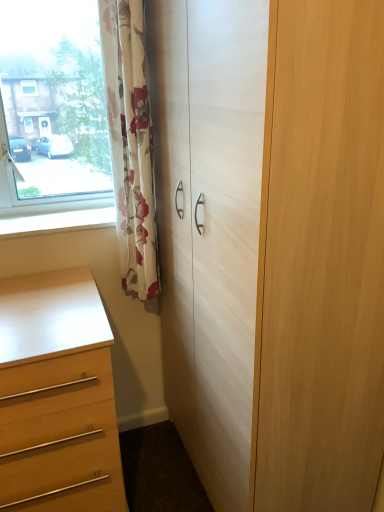
The width and height of the screenshot is (384, 512). I want to click on white wood cupboard at center, so click(272, 245).

At what (x,y) coordinates should I click in order to perform the action: click on white wood cupboard at center. Please return your answer as a coordinate pair (x, y). Looking at the image, I should click on (272, 245).

Do you think white glossy window sill at lower left is within floral fabric curtain at left, or outside of it?

white glossy window sill at lower left is spatially situated outside floral fabric curtain at left.

How many degrees apart are the facing directions of white glossy window sill at lower left and floral fabric curtain at left?

There is a 1.5-degree angle between the facing directions of white glossy window sill at lower left and floral fabric curtain at left.

From the image's perspective, is white glossy window sill at lower left beneath floral fabric curtain at left?

Yes.

Is matte wood chest of drawers at lower left closer to camera compared to white wood cupboard at center?

No, it is not.

How much distance is there between matte wood chest of drawers at lower left and white wood cupboard at center?

A distance of 20.18 inches exists between matte wood chest of drawers at lower left and white wood cupboard at center.

Is matte wood chest of drawers at lower left turned away from white wood cupboard at center?

matte wood chest of drawers at lower left does not have its back to white wood cupboard at center.

Consider the image. Which is closer, (39,222) or (93,483)?

Positioned in front is point (93,483).

How different are the orientations of white glossy window sill at lower left and matte wood chest of drawers at lower left in degrees?

They differ by 0.0898 degrees in their facing directions.

Does white glossy window sill at lower left appear on the right side of matte wood chest of drawers at lower left?

Indeed, white glossy window sill at lower left is positioned on the right side of matte wood chest of drawers at lower left.

Which object is wider, white glossy window sill at lower left or matte wood chest of drawers at lower left?

matte wood chest of drawers at lower left.

Is white wood cupboard at center next to matte wood chest of drawers at lower left and touching it?

No, white wood cupboard at center is not next to matte wood chest of drawers at lower left.

From a real-world perspective, who is located higher, white wood cupboard at center or matte wood chest of drawers at lower left?

From a 3D spatial view, white wood cupboard at center is above.

In the scene shown: Can you confirm if white wood cupboard at center is thinner than matte wood chest of drawers at lower left?

Yes.

You are a GUI agent. You are given a task and a screenshot of the screen. Output one action in this format:
    pyautogui.click(x=<x>, y=<y>)
    Task: Click on the chest of drawers lying on the left of white wood cupboard at center
    The width and height of the screenshot is (384, 512).
    Given the screenshot: What is the action you would take?
    pyautogui.click(x=57, y=396)

Is white glossy window sill at lower left aimed at white wood cupboard at center?

No, white glossy window sill at lower left is not facing towards white wood cupboard at center.

Who is bigger, white glossy window sill at lower left or white wood cupboard at center?

white wood cupboard at center.

Image resolution: width=384 pixels, height=512 pixels. I want to click on window sill lying above the white wood cupboard at center (from the image's perspective), so click(57, 221).

From the image's perspective, is white glossy window sill at lower left located above or below white wood cupboard at center?

From the image's perspective, white glossy window sill at lower left appears above white wood cupboard at center.

Which is less distant, (127, 187) or (73, 214)?

The point (127, 187) is closer.

Locate an element on the screen. The width and height of the screenshot is (384, 512). curtain above the white glossy window sill at lower left (from the image's perspective) is located at coordinates (130, 143).

Is floral fabric curtain at left wider than white glossy window sill at lower left?

In fact, floral fabric curtain at left might be narrower than white glossy window sill at lower left.

Image resolution: width=384 pixels, height=512 pixels. Identify the location of curtain lying on the left of white wood cupboard at center. (130, 143).

Which is closer to the camera, (113, 113) or (215, 280)?

The point (215, 280) is in front.

Would you say floral fabric curtain at left is inside or outside white wood cupboard at center?

floral fabric curtain at left is not inside white wood cupboard at center, it's outside.

Are floral fabric curtain at left and white wood cupboard at center far apart?

floral fabric curtain at left is near white wood cupboard at center, not far away.

This screenshot has width=384, height=512. In order to click on curtain on the right of white glossy window sill at lower left in this screenshot , I will do `click(130, 143)`.

Where is `cupboard in front of the matte wood chest of drawers at lower left`? cupboard in front of the matte wood chest of drawers at lower left is located at coordinates (272, 245).

Which object lies nearer to the anchor point matte wood chest of drawers at lower left, white glossy window sill at lower left or white wood cupboard at center?

white glossy window sill at lower left.

Considering their positions, is floral fabric curtain at left positioned closer to white glossy window sill at lower left than white wood cupboard at center?

Among the two, floral fabric curtain at left is located nearer to white glossy window sill at lower left.

Considering their positions, is matte wood chest of drawers at lower left positioned closer to white wood cupboard at center than floral fabric curtain at left?

floral fabric curtain at left lies closer to white wood cupboard at center than the other object.

Based on their spatial positions, is floral fabric curtain at left or white glossy window sill at lower left further from white wood cupboard at center?

white glossy window sill at lower left lies further to white wood cupboard at center than the other object.

From the image, which object appears to be nearer to white glossy window sill at lower left, matte wood chest of drawers at lower left or white wood cupboard at center?

The object closer to white glossy window sill at lower left is matte wood chest of drawers at lower left.

Looking at the image, which one is located closer to floral fabric curtain at left, matte wood chest of drawers at lower left or white glossy window sill at lower left?

Based on the image, white glossy window sill at lower left appears to be nearer to floral fabric curtain at left.

Which object lies further to the anchor point matte wood chest of drawers at lower left, floral fabric curtain at left or white glossy window sill at lower left?

Among the two, floral fabric curtain at left is located further to matte wood chest of drawers at lower left.

Considering their positions, is white glossy window sill at lower left positioned further to floral fabric curtain at left than matte wood chest of drawers at lower left?

matte wood chest of drawers at lower left is positioned further to the anchor floral fabric curtain at left.

Locate an element on the screen. curtain between white wood cupboard at center and white glossy window sill at lower left in the front-back direction is located at coordinates (130, 143).

I want to click on cupboard that lies between floral fabric curtain at left and matte wood chest of drawers at lower left from top to bottom, so click(272, 245).

The height and width of the screenshot is (512, 384). I want to click on window sill that lies between floral fabric curtain at left and matte wood chest of drawers at lower left from top to bottom, so click(57, 221).

Where is `the chest of drawers located between white wood cupboard at center and white glossy window sill at lower left in the depth direction`? the chest of drawers located between white wood cupboard at center and white glossy window sill at lower left in the depth direction is located at coordinates (57, 396).